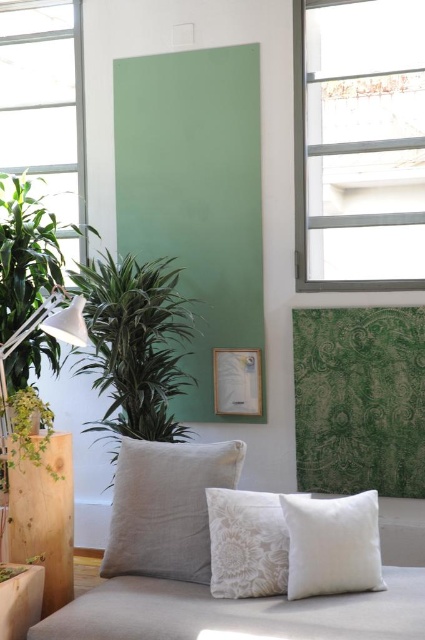
Consider the image. You are a delivery person trying to place a package between the clear glass window at upper right and the transparent glass window at upper left. The package measures 5 feet in length. Will it fit between them?

The clear glass window at upper right is 5.10 feet away from the transparent glass window at upper left, so the package measuring 5 feet in length will fit between them since the distance is slightly longer than the package.

You are standing in the room and want to know where the transparent glass window at upper left is positioned relative to the sofa. Can you determine its location based on the scene description?

The transparent glass window at upper left is located at point coordinates of (45, 106) relative to the sofa.